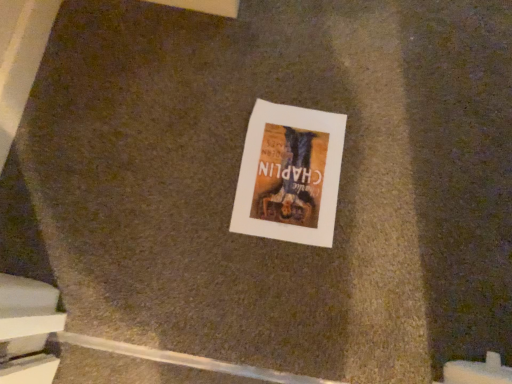
This screenshot has width=512, height=384. I want to click on matte paper poster at center, so 289,174.

From the picture: What is the approximate height of matte paper poster at center?

The height of matte paper poster at center is 3.18 centimeters.

The width and height of the screenshot is (512, 384). What do you see at coordinates (289, 174) in the screenshot?
I see `matte paper poster at center` at bounding box center [289, 174].

You are a GUI agent. You are given a task and a screenshot of the screen. Output one action in this format:
    pyautogui.click(x=<x>, y=<y>)
    Task: Click on the matte paper poster at center
    
    Given the screenshot: What is the action you would take?
    pyautogui.click(x=289, y=174)